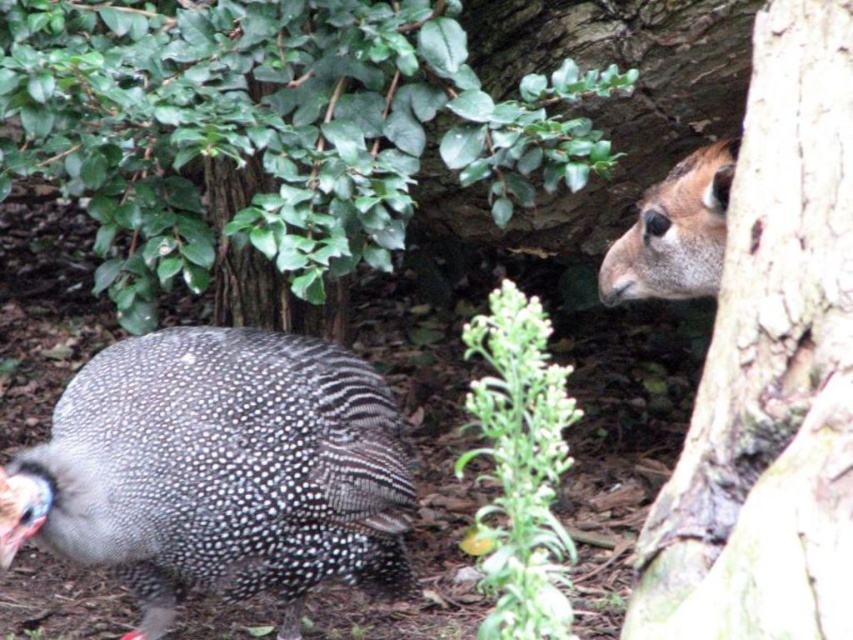
Question: Which of the following is the farthest from the observer?

Choices:
 (A) (776, 291)
 (B) (183, 451)

Answer: (B)

Question: Is green leafy bush at upper left thinner than green leafy plant at center?

Choices:
 (A) yes
 (B) no

Answer: (B)

Question: Among these objects, which one is farthest from the camera?

Choices:
 (A) green leafy bush at upper left
 (B) speckled feathered guinea fowl at lower left
 (C) brown rough tree trunk at right
 (D) green leafy plant at center

Answer: (D)

Question: Which of the following is the closest to the observer?

Choices:
 (A) (656, 544)
 (B) (354, 356)
 (C) (28, 40)

Answer: (A)

Question: Can you confirm if green leafy bush at upper left is wider than speckled feathered guinea fowl at lower left?

Choices:
 (A) yes
 (B) no

Answer: (A)

Question: Is green leafy bush at upper left to the left of speckled feathered guinea fowl at lower left from the viewer's perspective?

Choices:
 (A) yes
 (B) no

Answer: (B)